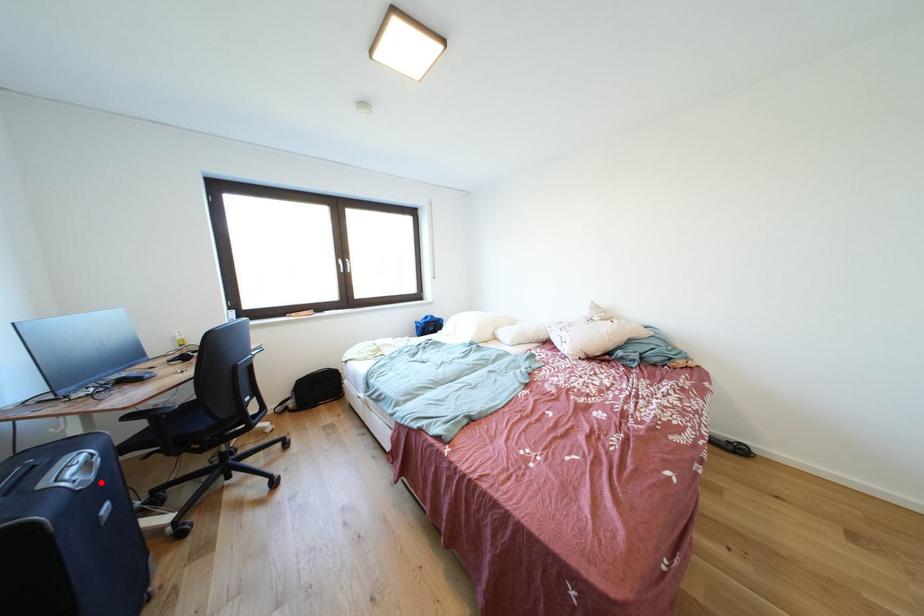
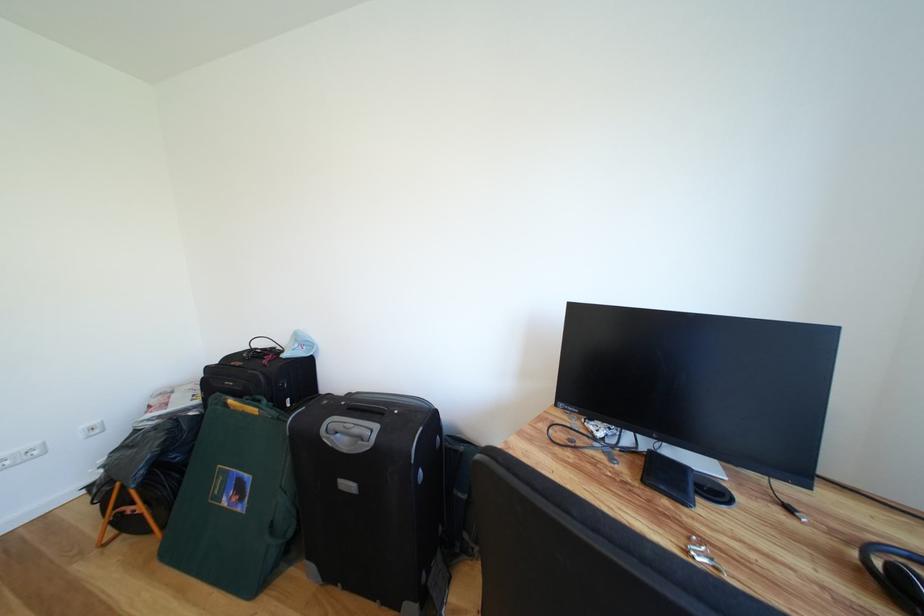
Question: I am providing you with two images of the same scene from different viewpoints. A red point is marked on the first image. Is the red point's position out of view in image 2?

Choices:
 (A) Yes
 (B) No

Answer: (B)